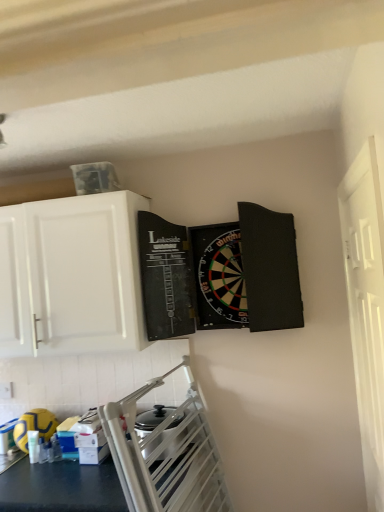
Describe the element at coordinates (366, 307) in the screenshot. I see `white wooden door at right` at that location.

Where is `white glossy cabinet at upper left`? white glossy cabinet at upper left is located at coordinates (71, 276).

Does yellow rubber ball at lower left turn towards white wooden door at right?

No, yellow rubber ball at lower left is not turned towards white wooden door at right.

From the image's perspective, which object appears higher, yellow rubber ball at lower left or white wooden door at right?

white wooden door at right.

Which of these two, yellow rubber ball at lower left or white wooden door at right, is thinner?

With smaller width is white wooden door at right.

From the image's perspective, relative to white glossy cabinet at upper left, is white wooden door at right above or below?

white wooden door at right is situated lower than white glossy cabinet at upper left in the image.

Is white wooden door at right aimed at white glossy cabinet at upper left?

Yes, white wooden door at right is aimed at white glossy cabinet at upper left.

Is point (372, 252) behind point (126, 318)?

That is False.

Is white wooden door at right positioned beyond the bounds of white glossy cabinet at upper left?

white wooden door at right is positioned outside white glossy cabinet at upper left.

Which of these two, yellow rubber ball at lower left or white glossy cabinet at upper left, stands taller?

With more height is white glossy cabinet at upper left.

Is yellow rubber ball at lower left far away from white glossy cabinet at upper left?

yellow rubber ball at lower left is actually quite close to white glossy cabinet at upper left.

Is point (51, 433) closer or farther from the camera than point (22, 261)?

Clearly, point (51, 433) is more distant from the camera than point (22, 261).

Is yellow rubber ball at lower left inside or outside of white glossy cabinet at upper left?

yellow rubber ball at lower left lies outside white glossy cabinet at upper left.

Which of these two, white glossy cabinet at upper left or white wooden door at right, is smaller?

white wooden door at right.

What's the angular difference between white glossy cabinet at upper left and white wooden door at right's facing directions?

89.3 degrees separate the facing orientations of white glossy cabinet at upper left and white wooden door at right.

Considering the relative sizes of white glossy cabinet at upper left and white wooden door at right in the image provided, is white glossy cabinet at upper left thinner than white wooden door at right?

Incorrect, the width of white glossy cabinet at upper left is not less than that of white wooden door at right.

Is white glossy cabinet at upper left not close to white wooden door at right?

Absolutely, white glossy cabinet at upper left is distant from white wooden door at right.

In terms of size, does white wooden door at right appear bigger or smaller than yellow rubber ball at lower left?

Clearly, white wooden door at right is larger in size than yellow rubber ball at lower left.

Is white wooden door at right next to yellow rubber ball at lower left?

No, white wooden door at right is not making contact with yellow rubber ball at lower left.

Considering the sizes of objects white wooden door at right and yellow rubber ball at lower left in the image provided, who is taller, white wooden door at right or yellow rubber ball at lower left?

white wooden door at right.

Which is farther from the camera, (x=363, y=454) or (x=37, y=417)?

The point (x=37, y=417) is farther from the camera.

Which is closer to the camera, (116, 328) or (23, 435)?

The point (116, 328) is closer.

Between white glossy cabinet at upper left and yellow rubber ball at lower left, which one has more height?

white glossy cabinet at upper left.

How different are the orientations of white glossy cabinet at upper left and yellow rubber ball at lower left in degrees?

The angle between the facing direction of white glossy cabinet at upper left and the facing direction of yellow rubber ball at lower left is 0.178 degrees.

Find the location of a particular element. The height and width of the screenshot is (512, 384). window in front of the yellow rubber ball at lower left is located at coordinates (366, 307).

The width and height of the screenshot is (384, 512). Identify the location of window on the right of white glossy cabinet at upper left. (366, 307).

Looking at the image, which one is located further to white glossy cabinet at upper left, white wooden door at right or yellow rubber ball at lower left?

white wooden door at right lies further to white glossy cabinet at upper left than the other object.

Considering their positions, is white glossy cabinet at upper left positioned further to yellow rubber ball at lower left than white wooden door at right?

white wooden door at right is further to yellow rubber ball at lower left.

Estimate the real-world distances between objects in this image. Which object is closer to white wooden door at right, white glossy cabinet at upper left or yellow rubber ball at lower left?

white glossy cabinet at upper left.

From the image, which object appears to be nearer to yellow rubber ball at lower left, white wooden door at right or white glossy cabinet at upper left?

white glossy cabinet at upper left is positioned closer to the anchor yellow rubber ball at lower left.

Based on their spatial positions, is yellow rubber ball at lower left or white wooden door at right further from white glossy cabinet at upper left?

Among the two, white wooden door at right is located further to white glossy cabinet at upper left.

Considering their positions, is yellow rubber ball at lower left positioned closer to white wooden door at right than white glossy cabinet at upper left?

white glossy cabinet at upper left is positioned closer to the anchor white wooden door at right.

The image size is (384, 512). In order to click on cabinetry located between yellow rubber ball at lower left and white wooden door at right in the left-right direction in this screenshot , I will do pyautogui.click(x=71, y=276).